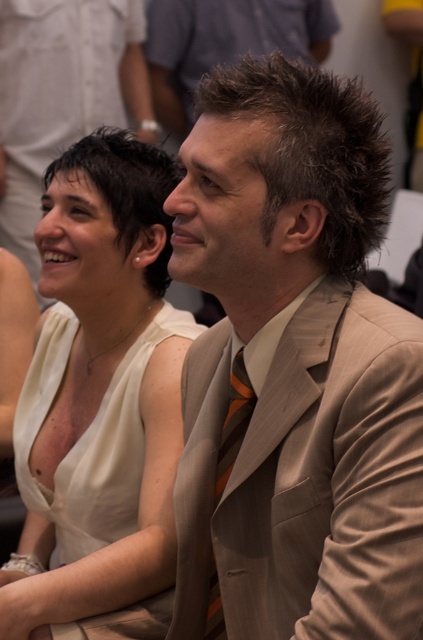
Does beige suit at center have a larger size compared to orange striped tie at center?

Correct, beige suit at center is larger in size than orange striped tie at center.

Can you confirm if beige suit at center is shorter than orange striped tie at center?

Incorrect, beige suit at center's height does not fall short of orange striped tie at center's.

What do you see at coordinates (60, 93) in the screenshot?
I see `beige suit at center` at bounding box center [60, 93].

Find the location of a particular element. This screenshot has height=640, width=423. beige suit at center is located at coordinates pos(60,93).

This screenshot has height=640, width=423. I want to click on matte white dress at center, so click(98, 392).

From the picture: Which is more to the right, matte white dress at center or dark brown spiky hair at upper center?

Positioned to the right is dark brown spiky hair at upper center.

At what (x,y) coordinates should I click in order to perform the action: click on matte white dress at center. Please return your answer as a coordinate pair (x, y). The width and height of the screenshot is (423, 640). Looking at the image, I should click on (98, 392).

Between point (296, 632) and point (167, 532), which one is positioned behind?

Point (167, 532)

Is tan fabric suit at center shorter than matte white dress at center?

Correct, tan fabric suit at center is not as tall as matte white dress at center.

Which is behind, point (186, 196) or point (110, 298)?

The point (110, 298) is more distant.

Locate an element on the screen. The width and height of the screenshot is (423, 640). tan fabric suit at center is located at coordinates (293, 371).